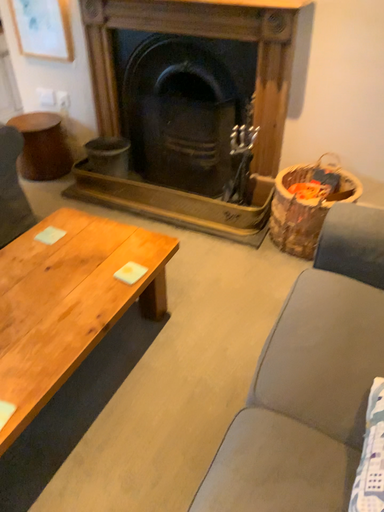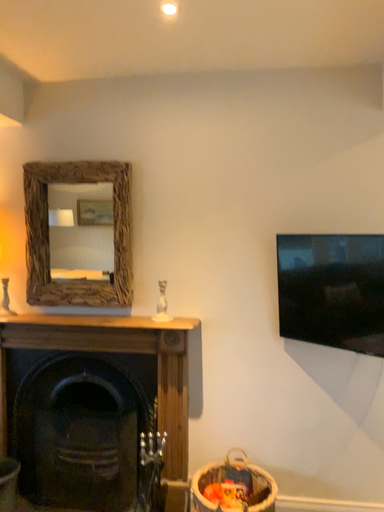
Question: Which way did the camera rotate in the video?

Choices:
 (A) rotated downward
 (B) rotated upward

Answer: (B)